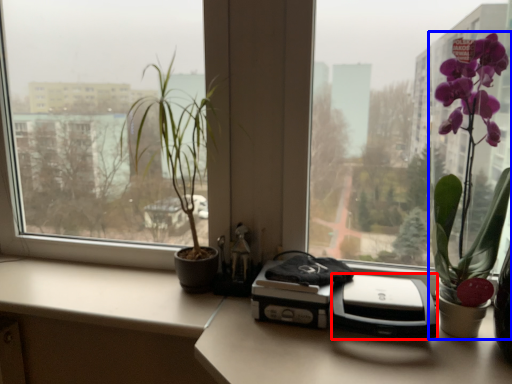
Question: Among these objects, which one is farthest to the camera, printer (highlighted by a red box) or houseplant (highlighted by a blue box)?

Choices:
 (A) printer
 (B) houseplant

Answer: (A)